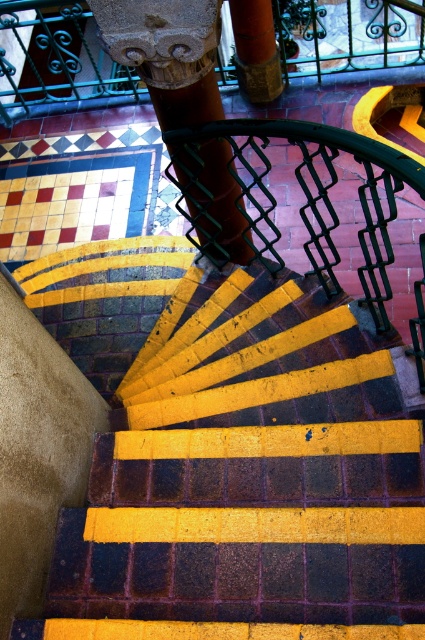
You are standing at the bottom of the spiral staircase and want to reach the green wrought iron at upper center. Which direction should you move relative to the yellow painted brick stairs at center?

To reach the green wrought iron at upper center, you should move upward from the yellow painted brick stairs at center since the yellow painted brick stairs at center is positioned under it.

You are standing at the base of the spiral staircase and want to reach the ornate column at the top. There is a point marked at coordinates point (249,480). Is this point located on the yellow painted brick stairs at center that you would step on during your climb?

Yes, the point (249,480) is on the yellow painted brick stairs at center, so it is part of the stairs you would step on while climbing towards the ornate column at the top.